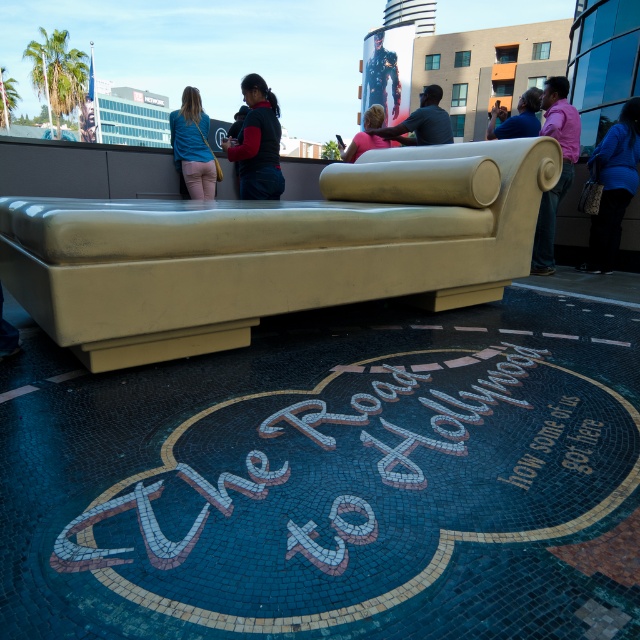
You are standing at the entrance of the public space and want to greet both the person wearing the matte black jacket at center and the person in the pink matte shirt at upper right. Which person is closer to you?

The matte black jacket at center is closer to you since it is only 10.59 feet away from the pink matte shirt at upper right, but since you are at the entrance, the distance from you to each would depend on their positions relative to the entrance. However, based on the given information, the matte black jacket at center is positioned closer to the entrance than the pink matte shirt at upper right.

You are a photographer at the event and need to capture both the matte black jacket at center and the pink matte shirt at upper right in a single frame. Which object should you focus on first to ensure both are in the frame?

Since the matte black jacket at center is smaller in size compared to the pink matte shirt at upper right, you should focus on the matte black jacket at center first to ensure it is fully captured in the frame.

You are a photographer trying to capture a photo of the pink fabric couch at center without including the pink matte shirt at upper right in the frame. Based on their positions, is this possible?

The pink matte shirt at upper right might be wider than the pink fabric couch at center, so there is a possibility that the shirt could be wider, making it difficult to exclude it from the frame. However, without exact measurements, it is uncertain. Consider adjusting your angle or position to ensure the shirt is out of view.